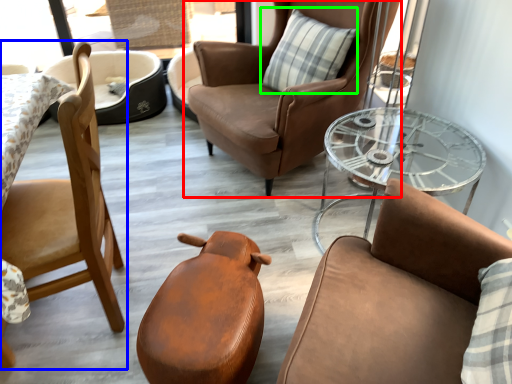
Question: Considering the real-world distances, which object is closest to chair (highlighted by a red box)? chair (highlighted by a blue box) or pillow (highlighted by a green box).

Choices:
 (A) chair
 (B) pillow

Answer: (B)